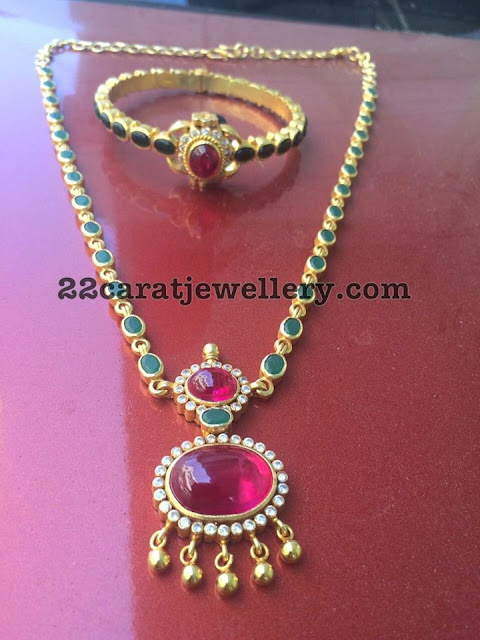
At what (x,y) coordinates should I click in order to perform the action: click on pendants. Please return your answer as a coordinate pair (x, y). Looking at the image, I should click on (213, 381), (213, 486).